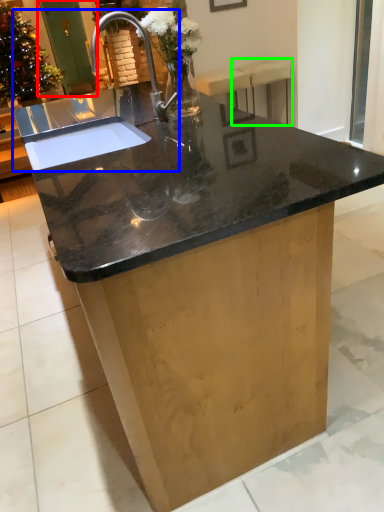
Question: Considering the real-world distances, which object is closest to screen door (highlighted by a red box)? sink (highlighted by a blue box) or bar stool (highlighted by a green box).

Choices:
 (A) sink
 (B) bar stool

Answer: (B)